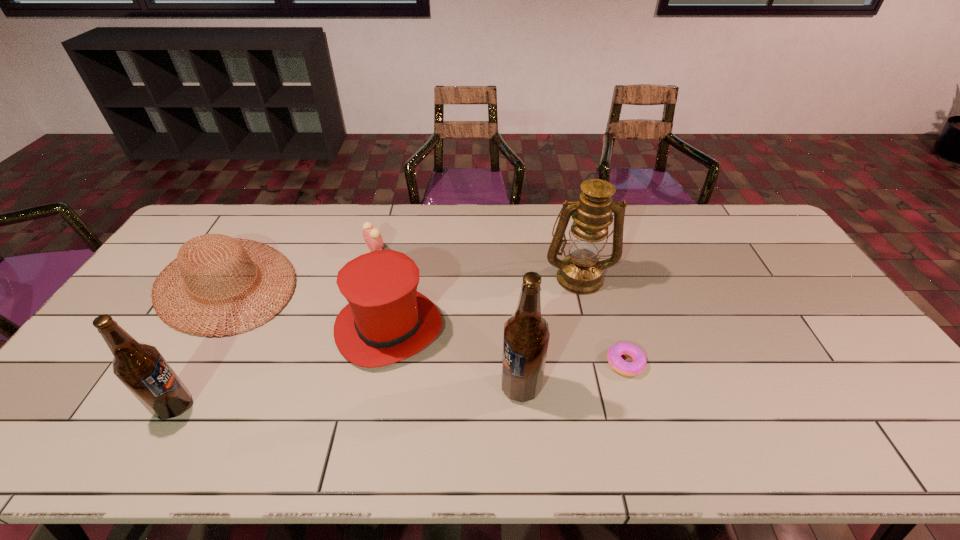
Find the location of a particular element. This screenshot has width=960, height=540. the left beer bottle is located at coordinates (140, 367).

Locate an element on the screen. The height and width of the screenshot is (540, 960). the right beer bottle is located at coordinates (526, 333).

You are a GUI agent. You are given a task and a screenshot of the screen. Output one action in this format:
    pyautogui.click(x=<x>, y=<y>)
    Task: Click on the third object from right to left
    The width and height of the screenshot is (960, 540).
    Given the screenshot: What is the action you would take?
    pyautogui.click(x=526, y=333)

Where is `the sixth tallest object`? the sixth tallest object is located at coordinates (372, 236).

This screenshot has height=540, width=960. I want to click on oil lamp, so click(580, 272).

The width and height of the screenshot is (960, 540). What are the coordinates of `the fifth tallest object` in the screenshot? It's located at (195, 254).

Identify the location of the fourth tallest object. (386, 320).

Locate an element on the screen. the shortest object is located at coordinates tap(618, 364).

Where is `free space located 0.360m on the label of the left beer bottle`? The height and width of the screenshot is (540, 960). free space located 0.360m on the label of the left beer bottle is located at coordinates (341, 406).

At what (x,y) coordinates should I click in order to perform the action: click on blank space located on the label of the right beer bottle. Please return your answer as a coordinate pair (x, y). This screenshot has height=540, width=960. Looking at the image, I should click on (389, 387).